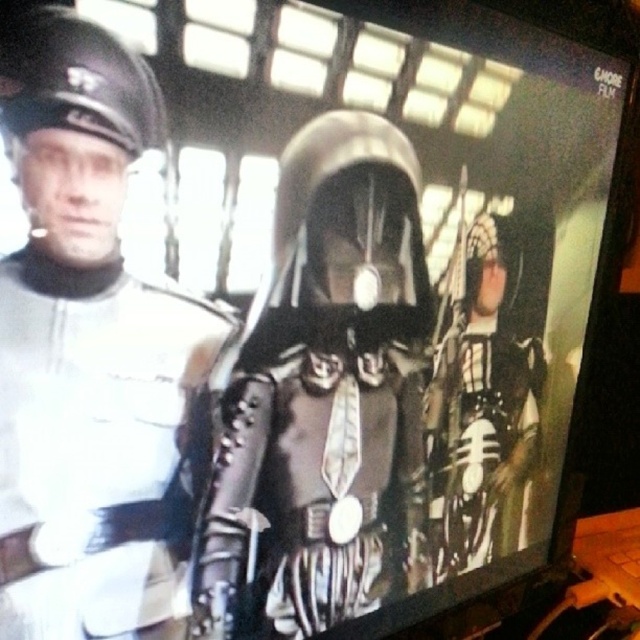
Question: Is white matte uniform at left to the right of black leather armor at center from the viewer's perspective?

Choices:
 (A) no
 (B) yes

Answer: (A)

Question: Is shiny silver armor at center to the left of black leather armor at center from the viewer's perspective?

Choices:
 (A) no
 (B) yes

Answer: (B)

Question: Estimate the real-world distances between objects in this image. Which object is closer to the shiny silver armor at center?

Choices:
 (A) white matte uniform at left
 (B) black leather armor at center

Answer: (B)

Question: Among these points, which one is farthest from the camera?

Choices:
 (A) (388, 326)
 (B) (138, 378)

Answer: (A)

Question: Does white matte uniform at left appear under shiny silver armor at center?

Choices:
 (A) yes
 (B) no

Answer: (B)

Question: Estimate the real-world distances between objects in this image. Which object is farther from the shiny silver armor at center?

Choices:
 (A) black leather armor at center
 (B) white matte uniform at left

Answer: (B)